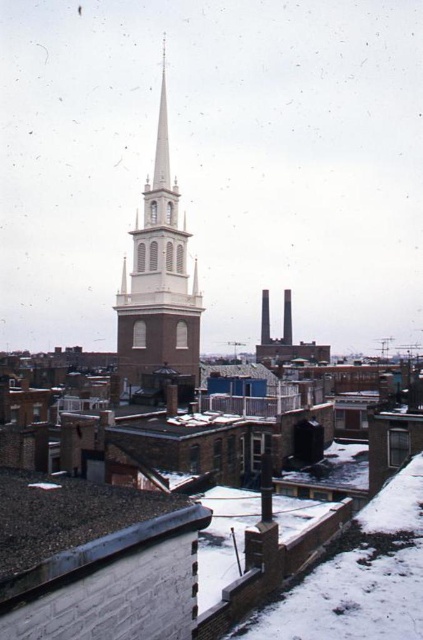
Between gray shingles at lower left and white brick steeple at center, which one appears on the left side from the viewer's perspective?

Positioned to the left is white brick steeple at center.

Between point (192, 525) and point (181, 321), which one is positioned in front?

Point (192, 525) is more forward.

Who is more distant from viewer, (96, 520) or (151, 196)?

The point (151, 196) is more distant.

I want to click on gray shingles at lower left, so click(77, 529).